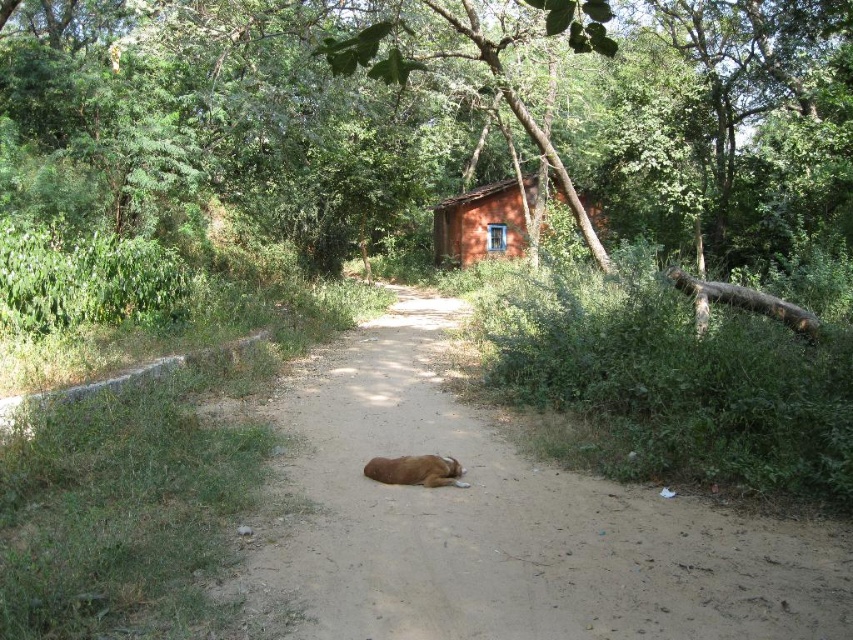
You are a hiker trying to navigate the dirt path through the forest. You notice two points marked on your map at coordinates point (x=437, y=257) and point (x=444, y=465). Which point is closer to you as you stand on the path?

Answer: Point (x=437, y=257) is closer to you because it is further to the viewer than point (x=444, y=465), meaning it is nearer in the scene.

You are a hiker planning to walk along the brown dirt track at center and want to reach the orange clay cabin at center. Based on the scene, which direction should you head to move from the track towards the cabin?

The brown dirt track at center is located below the orange clay cabin at center, so you should head upwards from the track to reach the cabin.

You are standing at the point with coordinates (502, 524) in the image. What surface are you currently standing on?

The point with coordinates (502, 524) is on the brown dirt track at center, so you are standing on the dirt track.